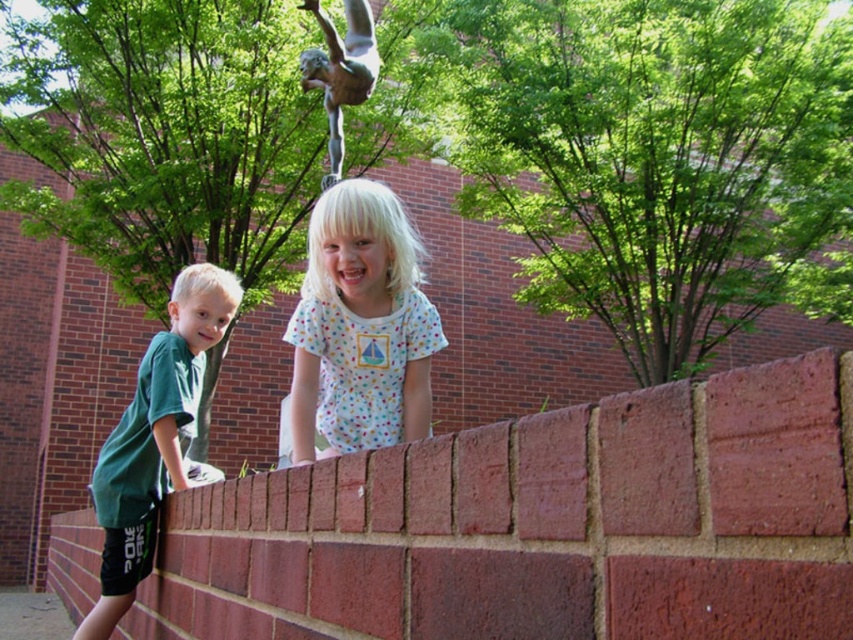
From the picture: You are a photographer trying to capture both the brick wall at center and the green patina statue at upper center in a single shot. Given that the statue is smaller, which object should you focus on first to ensure both are in frame?

Since the brick wall at center is larger in size than the green patina statue at upper center, you should focus on framing the larger brick wall at center first to ensure it fits, then adjust to include the smaller statue.

From the picture: You are a photographer trying to capture a clear shot of the brick wall at center and the green patina statue at upper center. Since the statue is partially obscured by the wall, can you adjust your position to see both fully? Explain using their positions.

The brick wall at center is closer to the viewer than the green patina statue at upper center. By moving your position to the side, you can shift the angle so that the wall no longer blocks the statue, allowing both to be seen clearly.

You are a photographer setting up a camera at eye level with the children. You want to ensure both the white dotted shirt at center and the green matte shirt at left are clearly visible in the shot. Which shirt should you focus on first to ensure proper focus, considering their heights?

The white dotted shirt at center is shorter than the green matte shirt at left, so you should focus on the green matte shirt at left first since it is taller and will require adjusting focus to capture both effectively.